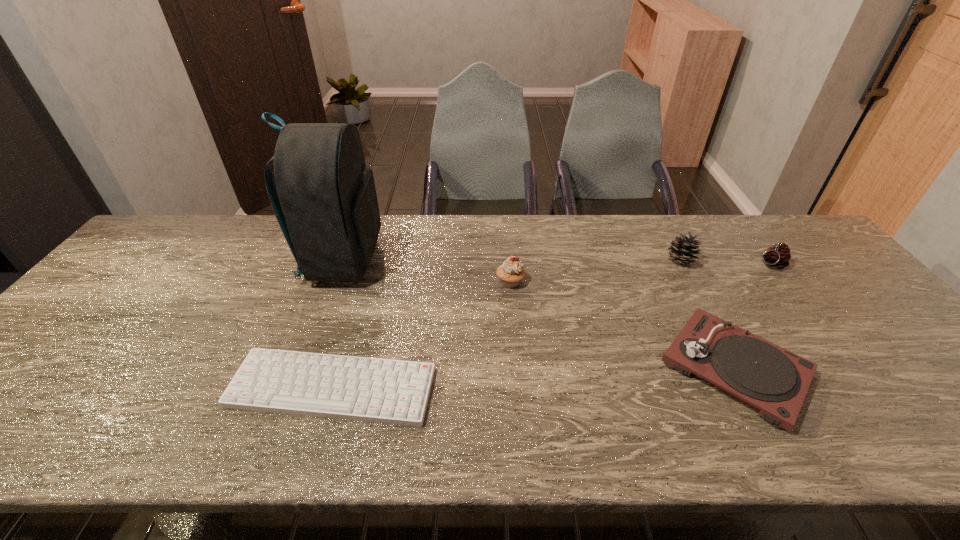
I want to click on backpack, so click(326, 204).

At what (x,y) coordinates should I click in order to perform the action: click on the left pinecone. Please return your answer as a coordinate pair (x, y). Looking at the image, I should click on (682, 251).

Identify the location of cupcake. Image resolution: width=960 pixels, height=540 pixels. (511, 272).

I want to click on the shorter pinecone, so click(778, 256).

Identify the location of the right pinecone. (778, 256).

Where is `the fifth tallest object`? This screenshot has width=960, height=540. the fifth tallest object is located at coordinates (765, 376).

You are a GUI agent. You are given a task and a screenshot of the screen. Output one action in this format:
    pyautogui.click(x=<x>, y=<y>)
    Task: Click on the shortest object
    Image resolution: width=960 pixels, height=540 pixels.
    Given the screenshot: What is the action you would take?
    pyautogui.click(x=386, y=391)

Find the location of `vacant area located on the front-facing side of the backpack`. vacant area located on the front-facing side of the backpack is located at coordinates (496, 259).

Locate an element on the screen. vacant space located 0.100m on the back of the taller pinecone is located at coordinates (664, 232).

The image size is (960, 540). Identify the location of free location located on the back of the third object from left to right. (507, 234).